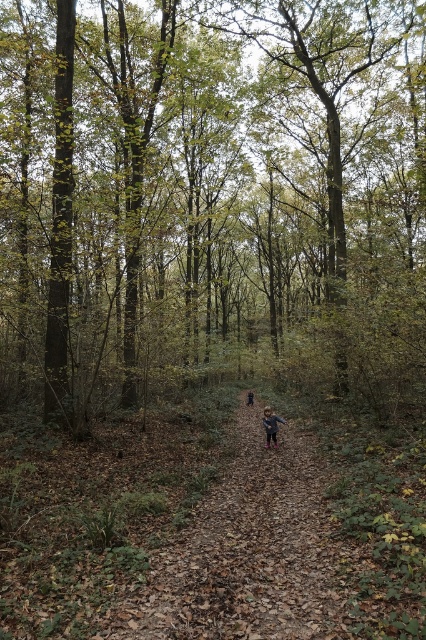
Is light brown leather boots at center above blue fabric person at center?

Indeed, light brown leather boots at center is positioned over blue fabric person at center.

Between point (281, 419) and point (247, 401), which one is positioned in front?

Point (281, 419) is in front.

This screenshot has width=426, height=640. What are the coordinates of `light brown leather boots at center` in the screenshot? It's located at (270, 426).

Who is shorter, brown wood tree at center or light brown leather boots at center?

With less height is light brown leather boots at center.

Looking at this image, does brown wood tree at center appear over light brown leather boots at center?

Indeed, brown wood tree at center is positioned over light brown leather boots at center.

Is point (55, 124) closer to viewer compared to point (264, 410)?

Yes, it is in front of point (264, 410).

Identify the location of brown wood tree at center. The height and width of the screenshot is (640, 426). (210, 196).

The width and height of the screenshot is (426, 640). Find the location of `brown wood tree at center`. brown wood tree at center is located at coordinates (210, 196).

Between brown wood tree at center and blue fabric person at center, which one has more height?

brown wood tree at center is taller.

The image size is (426, 640). Identify the location of brown wood tree at center. (210, 196).